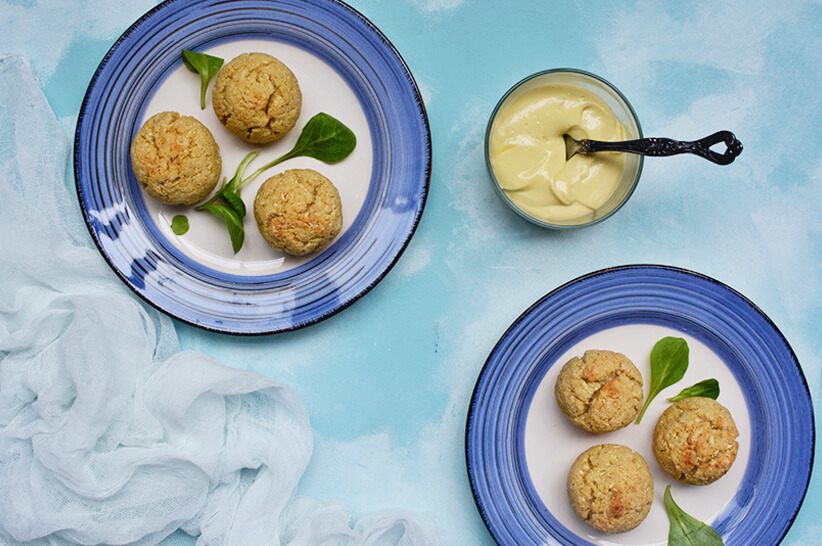
The height and width of the screenshot is (546, 822). I want to click on cloth, so click(x=187, y=415).